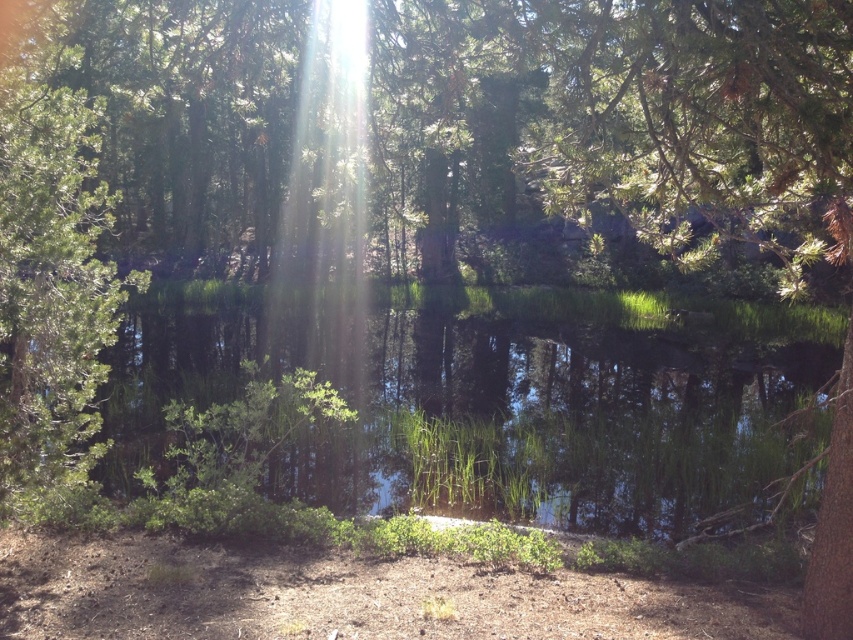
From the picture: Is green matte tree at upper center further to camera compared to green reflective water at center?

No, green matte tree at upper center is in front of green reflective water at center.

Image resolution: width=853 pixels, height=640 pixels. Describe the element at coordinates (621, 115) in the screenshot. I see `green matte tree at upper center` at that location.

Image resolution: width=853 pixels, height=640 pixels. I want to click on green matte tree at upper center, so click(x=621, y=115).